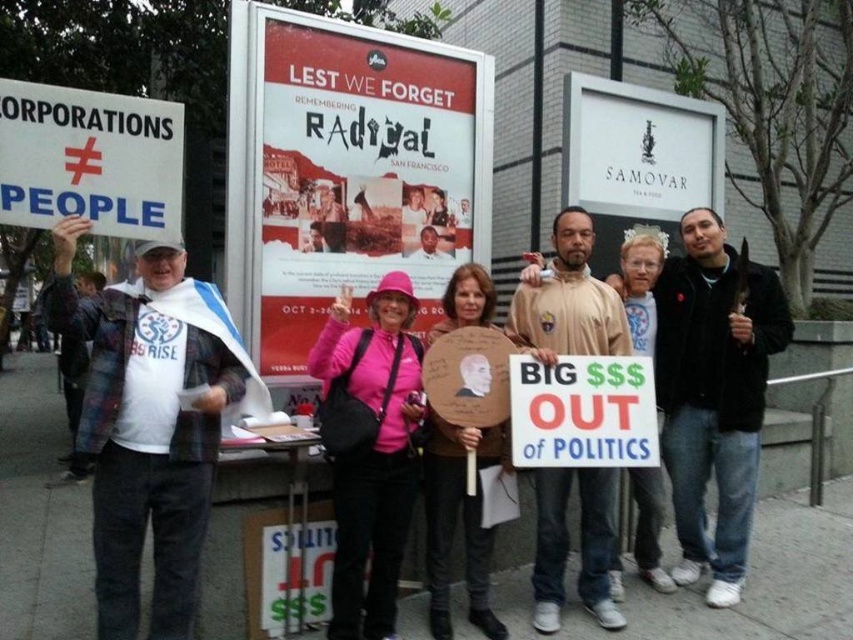
Question: Is matte paper poster at center thinner than pink fabric hat at center?

Choices:
 (A) no
 (B) yes

Answer: (A)

Question: Can you confirm if matte paper poster at center is positioned above black leather jacket at right?

Choices:
 (A) no
 (B) yes

Answer: (B)

Question: Does matte paper poster at center appear over black leather jacket at right?

Choices:
 (A) no
 (B) yes

Answer: (B)

Question: Which object is the closest to the tan fleece jacket at center?

Choices:
 (A) white paper sign at center
 (B) pink fabric hat at center

Answer: (A)

Question: Considering the real-world distances, which object is closest to the black leather jacket at right?

Choices:
 (A) white paper sign at center
 (B) white paper sign at left

Answer: (A)

Question: Which point is closer to the camera?

Choices:
 (A) 457,285
 (B) 643,326
 (C) 677,342
 (D) 155,627

Answer: (D)